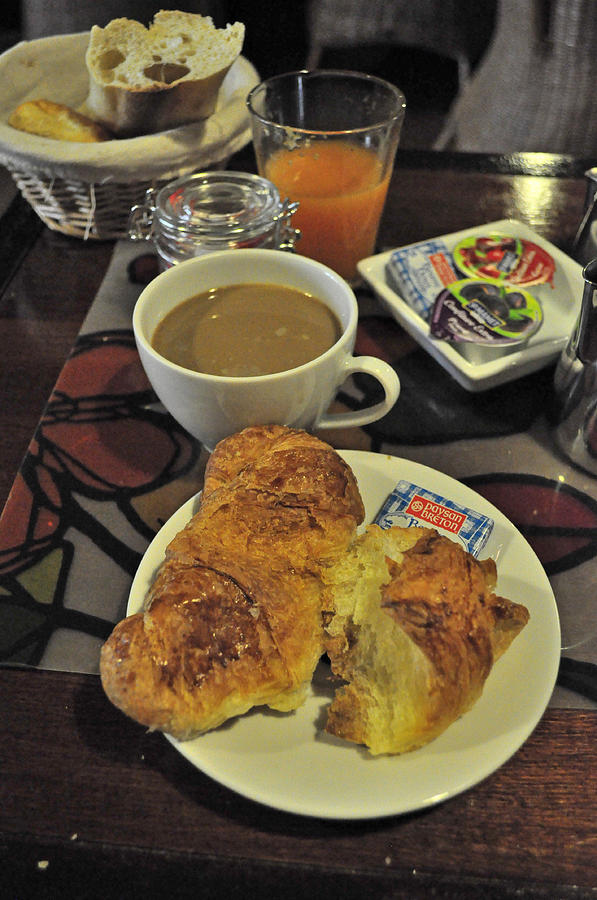
Where is `colorful mat`? The image size is (597, 900). colorful mat is located at coordinates (149, 457).